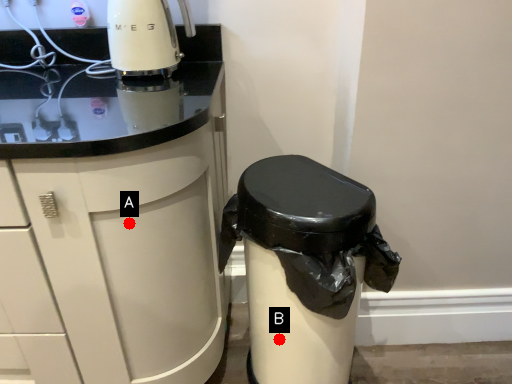
Question: Two points are circled on the image, labeled by A and B beside each circle. Which point is farther to the camera?

Choices:
 (A) A is further
 (B) B is further

Answer: (B)